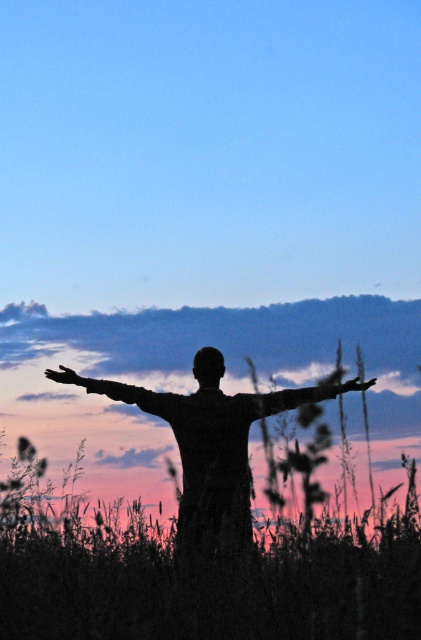
Image resolution: width=421 pixels, height=640 pixels. Describe the element at coordinates (207, 584) in the screenshot. I see `green grassy at center` at that location.

Between point (42, 560) and point (368, 380), which one is positioned in front?

Point (42, 560) is more forward.

Locate an element on the screen. Image resolution: width=421 pixels, height=640 pixels. green grassy at center is located at coordinates (207, 584).

Can you confirm if green grassy at center is smaller than silvery metallic arm at center?

Actually, green grassy at center might be larger than silvery metallic arm at center.

Is green grassy at center above silvery metallic arm at center?

Incorrect, green grassy at center is not positioned above silvery metallic arm at center.

Is point (151, 580) closer to viewer compared to point (242, 397)?

Yes.

Identify the location of green grassy at center. (207, 584).

Is silhouette figure at center positioned before matte black hand at upper left?

Yes, it is.

Does silhouette figure at center appear under matte black hand at upper left?

Yes, silhouette figure at center is below matte black hand at upper left.

Find the location of a particular element. The height and width of the screenshot is (640, 421). silhouette figure at center is located at coordinates (212, 444).